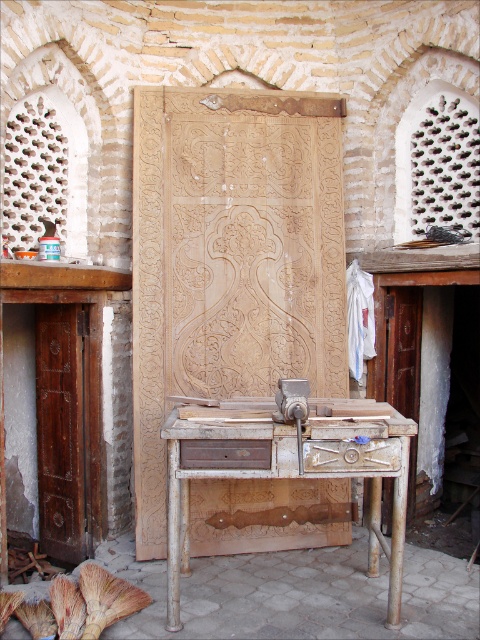
Which is behind, point (295, 444) or point (207, 438)?

The point (295, 444) is more distant.

Where is `rusty metal workbench at center`? This screenshot has width=480, height=640. rusty metal workbench at center is located at coordinates (295, 467).

Which of these two, brushed wood drawer at center or brown wood drawer at center, stands taller?

brushed wood drawer at center

Is point (391, 465) in front of point (229, 449)?

No, it is not.

Where is `brushed wood drawer at center`? brushed wood drawer at center is located at coordinates (351, 454).

Is rusty metal workbench at center above brushed wood drawer at center?

Actually, rusty metal workbench at center is below brushed wood drawer at center.

Can you confirm if rusty metal workbench at center is positioned to the left of brushed wood drawer at center?

Correct, you'll find rusty metal workbench at center to the left of brushed wood drawer at center.

Between point (226, 408) and point (354, 467), which one is positioned in front?

Positioned in front is point (354, 467).

Locate an element on the screen. rusty metal workbench at center is located at coordinates (295, 467).